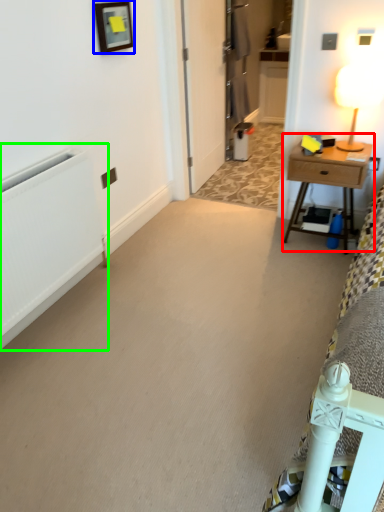
Question: Which is farther away from nightstand (highlighted by a red box)? picture frame (highlighted by a blue box) or radiator (highlighted by a green box)?

Choices:
 (A) picture frame
 (B) radiator

Answer: (B)